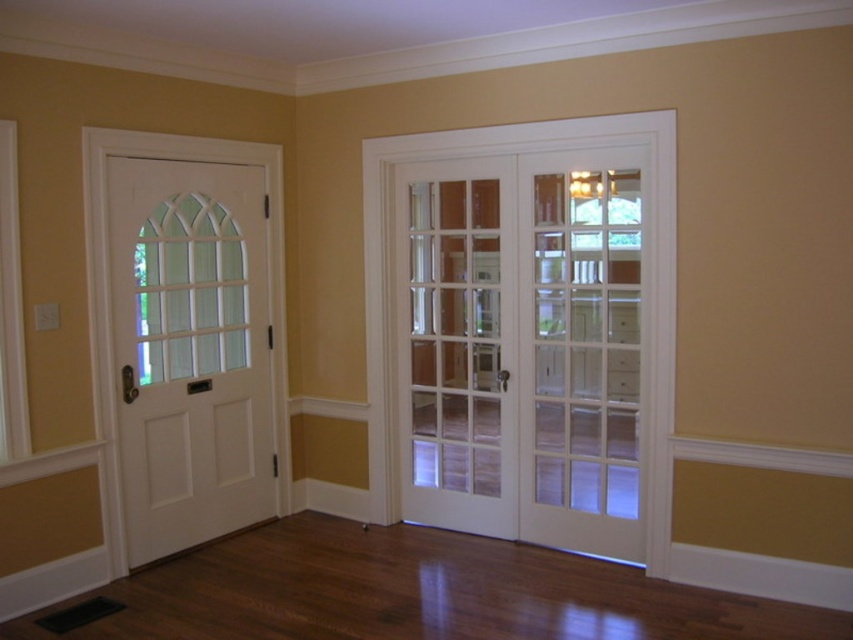
Question: Which is nearer to the white glossy door at left?

Choices:
 (A) clear glass doors at center
 (B) clear glass door at center

Answer: (A)

Question: Is clear glass doors at center below clear glass door at center?

Choices:
 (A) no
 (B) yes

Answer: (A)

Question: Among these objects, which one is nearest to the camera?

Choices:
 (A) clear glass doors at center
 (B) white glossy door at left

Answer: (A)

Question: Does clear glass doors at center have a larger size compared to white glossy door at left?

Choices:
 (A) no
 (B) yes

Answer: (B)

Question: Which point is farther to the camera?

Choices:
 (A) (134, 332)
 (B) (480, 234)
 (C) (633, 496)

Answer: (B)

Question: Can you confirm if white glossy door at left is positioned to the right of clear glass door at center?

Choices:
 (A) no
 (B) yes

Answer: (A)